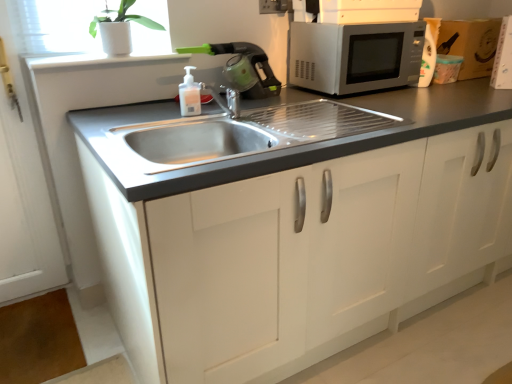
What do you see at coordinates (243, 68) in the screenshot? This screenshot has width=512, height=384. I see `green plastic coffee machine at upper center` at bounding box center [243, 68].

Where is `white glossy window sill at upper left`? The image size is (512, 384). white glossy window sill at upper left is located at coordinates (101, 61).

Describe the element at coordinates (101, 61) in the screenshot. I see `white glossy window sill at upper left` at that location.

Locate an element on the screen. This screenshot has height=384, width=512. satin silver microwave at upper right is located at coordinates (355, 56).

Looking at this image, is the depth of white glossy window sill at upper left less than that of black plastic electric outlet at upper center?

Yes.

Considering the sizes of objects white glossy window sill at upper left and black plastic electric outlet at upper center in the image provided, who is taller, white glossy window sill at upper left or black plastic electric outlet at upper center?

black plastic electric outlet at upper center.

Which of these two, white glossy window sill at upper left or black plastic electric outlet at upper center, is bigger?

white glossy window sill at upper left.

Based on the photo, is white glossy window sill at upper left completely or partially outside of black plastic electric outlet at upper center?

Yes.

The width and height of the screenshot is (512, 384). In order to click on electric outlet that is above the satin silver microwave at upper right (from the image's perspective) in this screenshot , I will do `click(274, 6)`.

Could you measure the distance between black plastic electric outlet at upper center and satin silver microwave at upper right?

The distance of black plastic electric outlet at upper center from satin silver microwave at upper right is 15.39 inches.

In the image, is black plastic electric outlet at upper center on the left side or the right side of satin silver microwave at upper right?

black plastic electric outlet at upper center is to the left of satin silver microwave at upper right.

How different are the orientations of white ceramic pot at upper left and white matte cabinet at center in degrees?

There is a 0.876-degree angle between the facing directions of white ceramic pot at upper left and white matte cabinet at center.

Is point (118, 14) farther from viewer compared to point (270, 116)?

That is True.

Considering the sizes of objects white ceramic pot at upper left and white matte cabinet at center in the image provided, who is thinner, white ceramic pot at upper left or white matte cabinet at center?

white ceramic pot at upper left.

Could you tell me if white ceramic pot at upper left is turned towards white matte cabinet at center?

→ No, white ceramic pot at upper left is not turned towards white matte cabinet at center.

From the image's perspective, does white matte cabinet at center appear higher than satin silver microwave at upper right?

Incorrect, from the image's perspective, white matte cabinet at center is lower than satin silver microwave at upper right.

Is white matte cabinet at center at the left side of satin silver microwave at upper right?

No, white matte cabinet at center is not to the left of satin silver microwave at upper right.

From a real-world perspective, is white matte cabinet at center located higher than satin silver microwave at upper right?

No, from a real-world perspective, white matte cabinet at center is not on top of satin silver microwave at upper right.

Considering the relative sizes of white matte cabinet at center and satin silver microwave at upper right in the image provided, is white matte cabinet at center smaller than satin silver microwave at upper right?

Actually, white matte cabinet at center might be larger than satin silver microwave at upper right.

Is white matte cabinet at center shorter than green plastic coffee machine at upper center?

No, white matte cabinet at center is not shorter than green plastic coffee machine at upper center.

Looking at the image, does white matte cabinet at center seem bigger or smaller compared to green plastic coffee machine at upper center?

Considering their sizes, white matte cabinet at center takes up more space than green plastic coffee machine at upper center.

Considering the sizes of objects white matte cabinet at center and green plastic coffee machine at upper center in the image provided, who is thinner, white matte cabinet at center or green plastic coffee machine at upper center?

green plastic coffee machine at upper center is thinner.

I want to click on cabinetry below the green plastic coffee machine at upper center (from the image's perspective), so click(x=293, y=226).

Does white ceramic pot at upper left have a greater height compared to brown cardboard box at upper right?

In fact, white ceramic pot at upper left may be shorter than brown cardboard box at upper right.

From a real-world perspective, between white ceramic pot at upper left and brown cardboard box at upper right, who is vertically lower?

From a 3D spatial view, brown cardboard box at upper right is below.

Is white ceramic pot at upper left positioned beyond the bounds of brown cardboard box at upper right?

Yes.

Is white ceramic pot at upper left positioned behind brown cardboard box at upper right?

No, it is not.

Between brown cardboard box at upper right and translucent plastic soap dispenser at center, which one appears on the left side from the viewer's perspective?

From the viewer's perspective, translucent plastic soap dispenser at center appears more on the left side.

From the image's perspective, is brown cardboard box at upper right under translucent plastic soap dispenser at center?

No, from the image's perspective, brown cardboard box at upper right is not beneath translucent plastic soap dispenser at center.

Is brown cardboard box at upper right inside the boundaries of translucent plastic soap dispenser at center, or outside?

brown cardboard box at upper right is not inside translucent plastic soap dispenser at center, it's outside.

Find the location of `electric outlet above the white glossy window sill at upper left (from the image's perspective)`. electric outlet above the white glossy window sill at upper left (from the image's perspective) is located at coordinates (274, 6).

Identify the location of microwave oven below the black plastic electric outlet at upper center (from a real-world perspective). This screenshot has width=512, height=384. (355, 56).

Estimate the real-world distances between objects in this image. Which object is further from green plastic coffee machine at upper center, white glossy window sill at upper left or translucent plastic soap dispenser at center?

Answer: Among the two, white glossy window sill at upper left is located further to green plastic coffee machine at upper center.

From the image, which object appears to be farther from white glossy window sill at upper left, brown cardboard box at upper right or black plastic electric outlet at upper center?

Among the two, brown cardboard box at upper right is located further to white glossy window sill at upper left.

From the image, which object appears to be nearer to white ceramic pot at upper left, black plastic electric outlet at upper center or green plastic coffee machine at upper center?

Among the two, green plastic coffee machine at upper center is located nearer to white ceramic pot at upper left.

When comparing their distances from white glossy window sill at upper left, does white ceramic pot at upper left or green plastic coffee machine at upper center seem further?

green plastic coffee machine at upper center.

Which object lies nearer to the anchor point green plastic coffee machine at upper center, white glossy window sill at upper left or white matte cabinet at center?

white glossy window sill at upper left is positioned closer to the anchor green plastic coffee machine at upper center.

From the image, which object appears to be nearer to green plastic coffee machine at upper center, satin silver microwave at upper right or brown cardboard box at upper right?

Based on the image, satin silver microwave at upper right appears to be nearer to green plastic coffee machine at upper center.

Considering their positions, is white ceramic pot at upper left positioned closer to green plastic coffee machine at upper center than satin silver microwave at upper right?

satin silver microwave at upper right is closer to green plastic coffee machine at upper center.

When comparing their distances from green plastic coffee machine at upper center, does satin silver microwave at upper right or white ceramic pot at upper left seem further?

white ceramic pot at upper left is further to green plastic coffee machine at upper center.

You are a GUI agent. You are given a task and a screenshot of the screen. Output one action in this format:
    pyautogui.click(x=<x>, y=<y>)
    Task: Click on the electric outlet between white ceramic pot at upper left and satin silver microwave at upper right in the horizontal direction
    
    Given the screenshot: What is the action you would take?
    pyautogui.click(x=274, y=6)

Where is `coffee machine between translucent plastic soap dispenser at center and white matte cabinet at center`? This screenshot has width=512, height=384. coffee machine between translucent plastic soap dispenser at center and white matte cabinet at center is located at coordinates (243, 68).

Identify the location of bottle between white glossy window sill at upper left and brown cardboard box at upper right from left to right. (189, 94).

Locate an element on the screen. bottle between white ceramic pot at upper left and brown cardboard box at upper right from left to right is located at coordinates (189, 94).